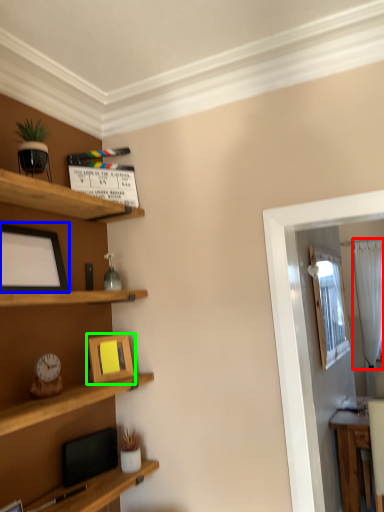
Question: Which is nearer to the curtain (highlighted by a red box)? picture frame (highlighted by a blue box) or picture frame (highlighted by a green box).

Choices:
 (A) picture frame
 (B) picture frame

Answer: (B)